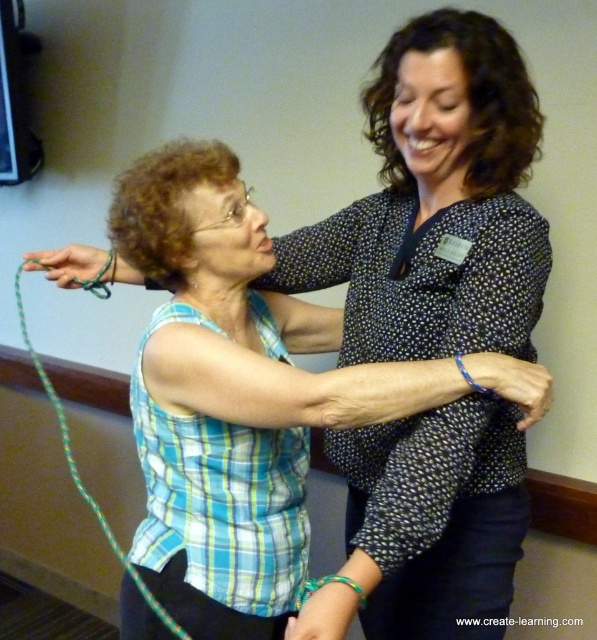
You are a photographer trying to capture a closeup shot of both the blue woven bracelet at center and the green braided string at left. Your camera can focus on objects within a 4 feet range. Can you capture both items in one shot without moving the camera?

The blue woven bracelet at center is 4.55 feet from the green braided string at left. Since the distance between them is greater than the camera focus range of 4 feet, you cannot capture both items in one shot without moving the camera.

You are an observer in the scene. You need to determine which object is wider between the matte green rope at upper left and the green braided string at left. Which one is wider?

The matte green rope at upper left is wider than the green braided string at left.